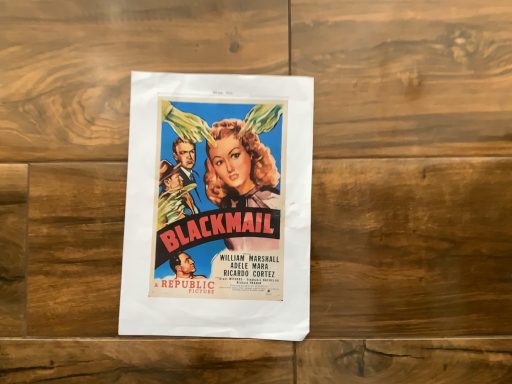
The width and height of the screenshot is (512, 384). I want to click on matte paper poster at center, so click(218, 207).

What is the approximate width of matte paper poster at center?

12.10 inches.

Describe the element at coordinates (218, 207) in the screenshot. I see `matte paper poster at center` at that location.

Where is `matte paper poster at center`? matte paper poster at center is located at coordinates (218, 207).